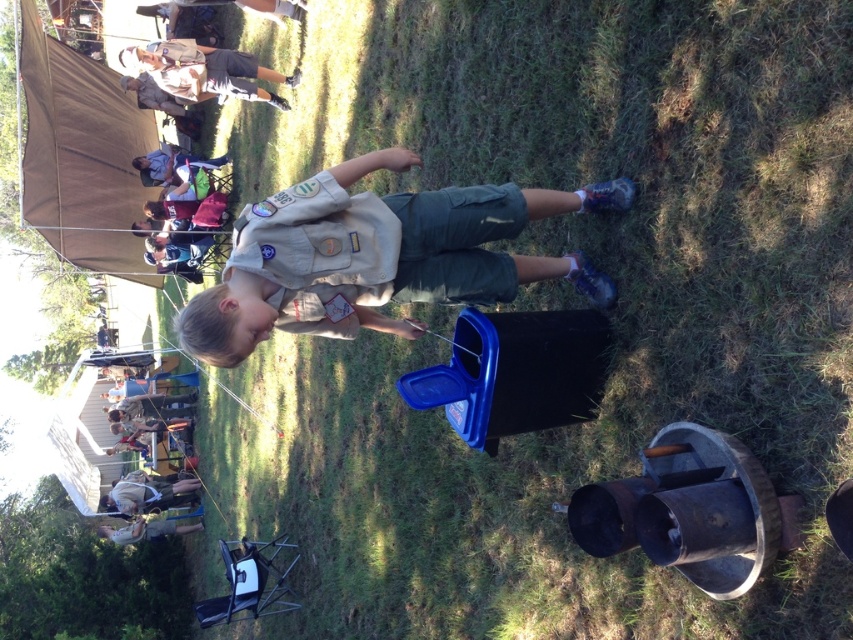
Question: Is khaki uniform at upper left to the right of light brown leather jacket at lower left from the viewer's perspective?

Choices:
 (A) no
 (B) yes

Answer: (B)

Question: Which point appears closest to the camera in this image?

Choices:
 (A) (102, 509)
 (B) (216, 77)

Answer: (B)

Question: Based on their relative distances, which object is nearer to the light brown wooden chair at lower left?

Choices:
 (A) light brown leather jacket at lower left
 (B) khaki uniform at upper left
 (C) tan uniform at center

Answer: (A)

Question: Does khaki uniform at upper left appear on the right side of light brown wooden chair at lower left?

Choices:
 (A) yes
 (B) no

Answer: (A)

Question: Which point is farther to the camera?

Choices:
 (A) (248, 259)
 (B) (138, 497)
 (C) (183, 529)
 (D) (152, 52)

Answer: (B)

Question: Can you confirm if tan uniform at center is smaller than light brown wooden chair at lower left?

Choices:
 (A) yes
 (B) no

Answer: (A)